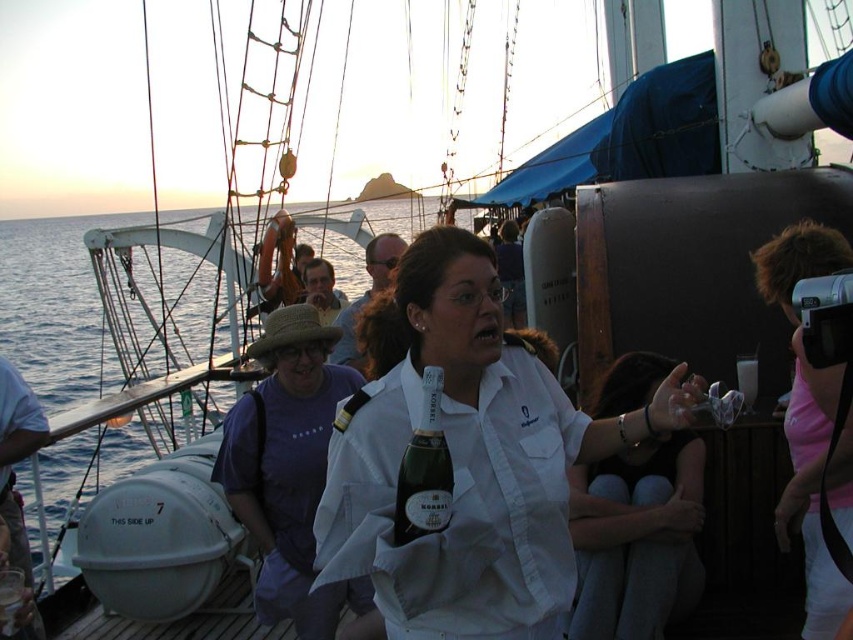
You are a photographer on the deck of the ship and want to capture a photo of the white matte shirt at center and the green glass bottle at center. Which object should you focus on first if you want to ensure both are in sharp focus?

The white matte shirt at center is below the green glass bottle at center. To ensure both are in sharp focus, focus on the green glass bottle at center first since it is closer to the camera, and the shirt will fall within the depth of field.

You are a photographer on the boat and want to take a photo of the white matte shirt at center. Where should you position yourself relative to the shirt to capture it in the frame?

The white matte shirt at center is located at point (636,538), so you should position yourself directly in front of the shirt at that coordinate to capture it in the frame.

You are a photographer on a boat and need to take a photo of the sunset. You have a pink fabric camera at right and a green glass bottle at center. Which object is positioned more to the right?

The pink fabric camera at right is positioned more to the right than the green glass bottle at center.